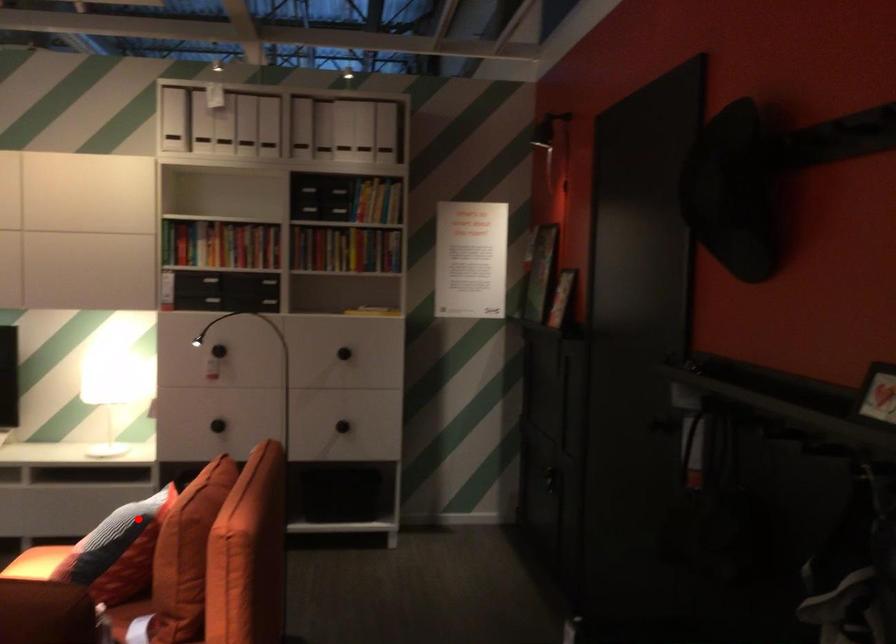
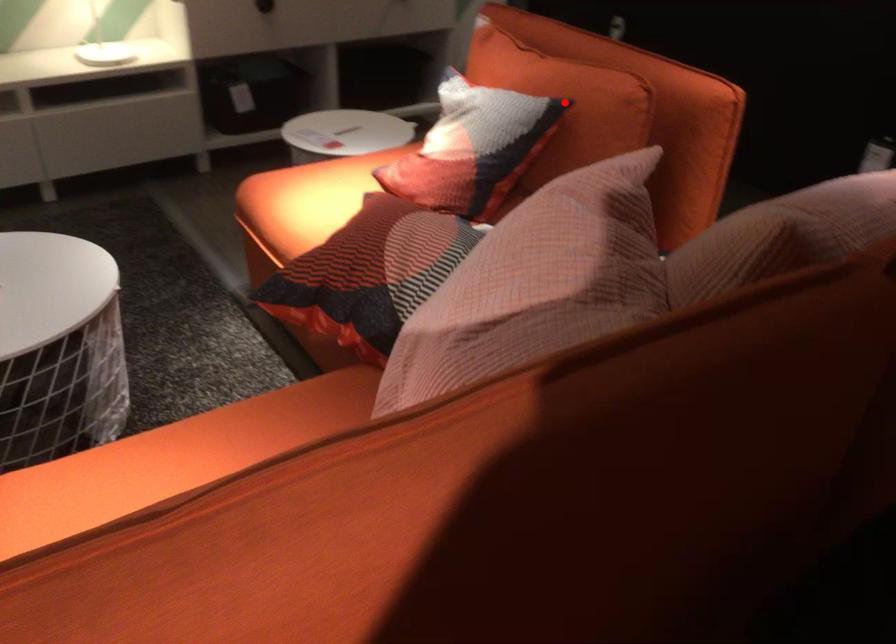
I am providing you with two images of the same scene from different viewpoints. A red point is marked on the first image and another point is marked on the second image. Do the highlighted points in image1 and image2 indicate the same real-world spot?

Yes